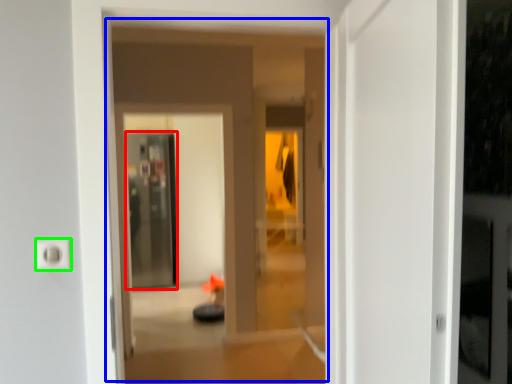
Question: Considering the real-world distances, which object is closest to screen door (highlighted by a red box)? hotel lobby (highlighted by a blue box) or electric outlet (highlighted by a green box).

Choices:
 (A) hotel lobby
 (B) electric outlet

Answer: (A)